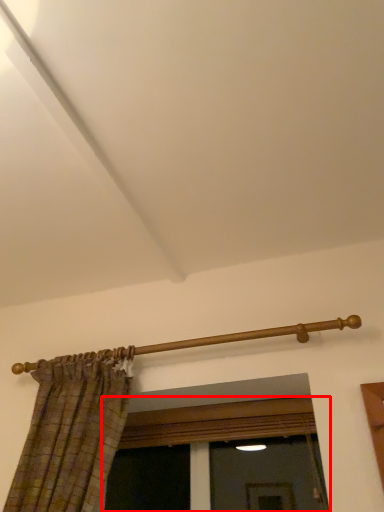
Question: Observing the image, what is the correct spatial positioning of window (annotated by the red box) in reference to rail?

Choices:
 (A) right
 (B) left

Answer: (A)